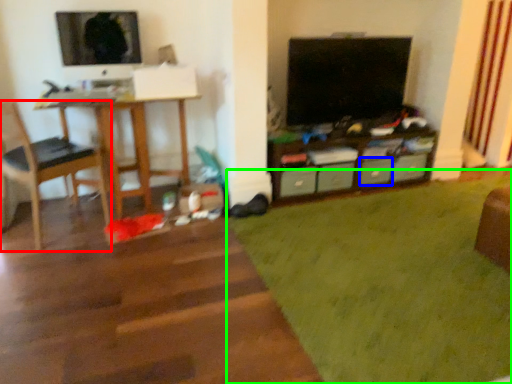
Question: Which object is the farthest from chair (highlighted by a red box)? Choose among these: drawer (highlighted by a blue box) or plain (highlighted by a green box).

Choices:
 (A) drawer
 (B) plain

Answer: (A)